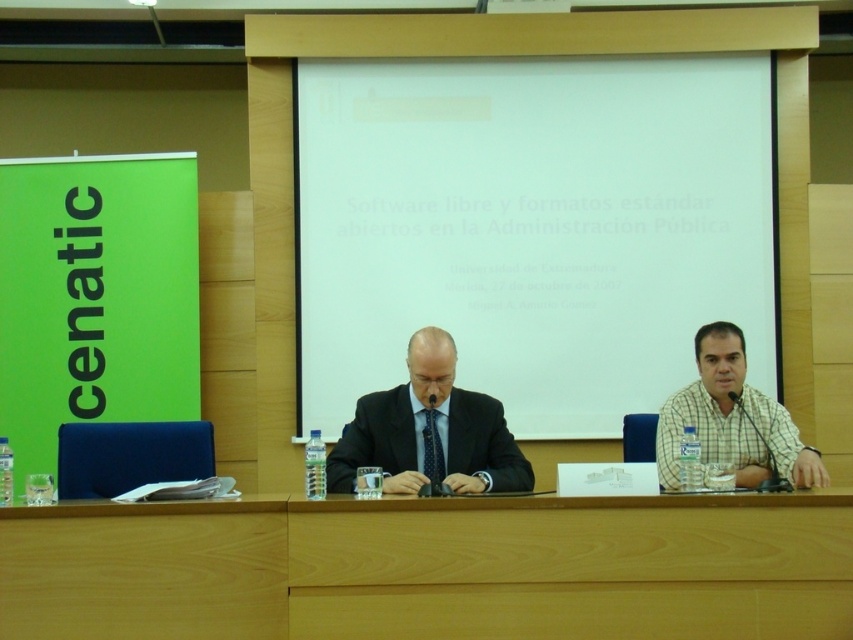
Question: Is light brown wood table at center smaller than checkered fabric shirt at right?

Choices:
 (A) yes
 (B) no

Answer: (A)

Question: Which is farther from the checkered fabric shirt at right?

Choices:
 (A) light brown wood table at center
 (B) matte black suit at center
 (C) white matte projector screen at center

Answer: (C)

Question: Among these objects, which one is farthest from the camera?

Choices:
 (A) white matte projector screen at center
 (B) light brown wood table at center
 (C) matte black suit at center
 (D) checkered fabric shirt at right

Answer: (A)

Question: Is white matte projector screen at center in front of light brown wood table at lower center?

Choices:
 (A) yes
 (B) no

Answer: (B)

Question: Is light brown wood table at lower center closer to the viewer compared to matte black suit at center?

Choices:
 (A) no
 (B) yes

Answer: (B)

Question: Considering the real-world distances, which object is closest to the light brown wood table at lower center?

Choices:
 (A) checkered fabric shirt at right
 (B) matte black suit at center

Answer: (B)